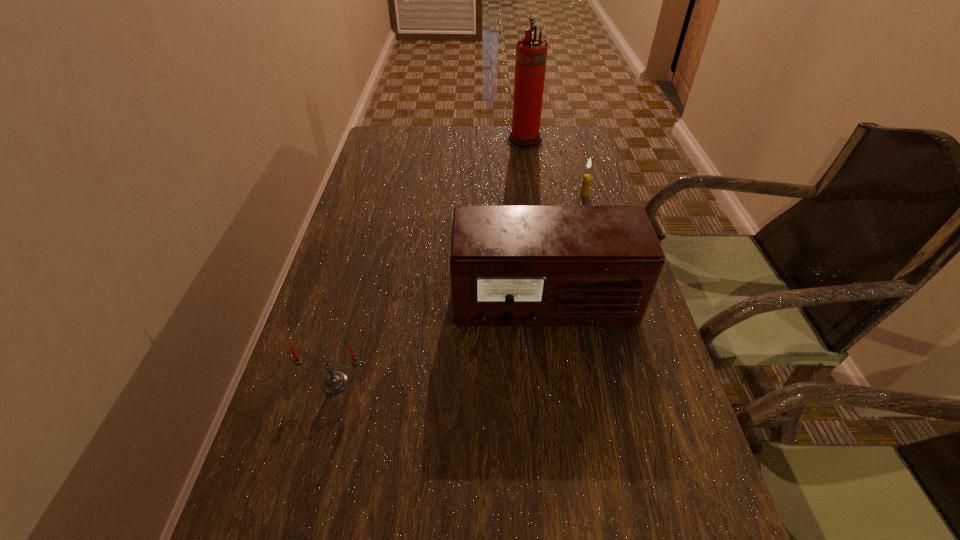
Find the location of a particular element. Image resolution: width=960 pixels, height=540 pixels. vacant space located 0.310m at the discharge end of the farthest object is located at coordinates (418, 141).

You are a GUI agent. You are given a task and a screenshot of the screen. Output one action in this format:
    pyautogui.click(x=<x>, y=<y>)
    Task: Click on the free space located 0.170m on the front-facing side of the third shortest object
    The width and height of the screenshot is (960, 540).
    Given the screenshot: What is the action you would take?
    pyautogui.click(x=559, y=410)

The width and height of the screenshot is (960, 540). Identify the location of free spot located 0.380m on the back of the farther candle. pyautogui.click(x=565, y=131).

This screenshot has height=540, width=960. I want to click on vacant point located on the front-facing side of the leftmost object, so click(x=324, y=424).

At what (x,y) coordinates should I click in order to perform the action: click on object that is at the far edge. Please return your answer as a coordinate pair (x, y). The height and width of the screenshot is (540, 960). Looking at the image, I should click on (531, 53).

Find the location of `object that is at the left edge`. object that is at the left edge is located at coordinates (334, 382).

Image resolution: width=960 pixels, height=540 pixels. I want to click on fire extinguisher that is at the right edge, so coord(531,53).

Locate an element on the screen. radio receiver that is at the right edge is located at coordinates (510, 265).

The image size is (960, 540). I want to click on candle that is at the right edge, so click(586, 181).

Image resolution: width=960 pixels, height=540 pixels. In order to click on object that is positioned at the far right corner in this screenshot , I will do `click(531, 53)`.